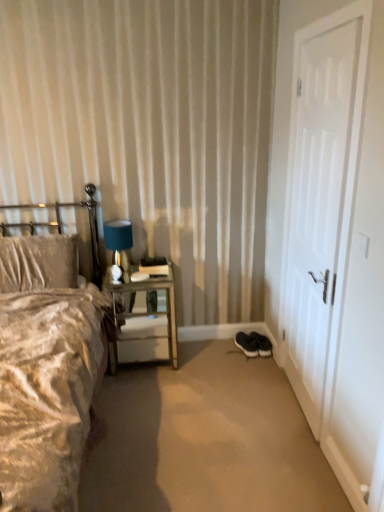
Identify the location of vacant area that lies between white matte door at right and black suede sneakers at lower right, arranged as the 2th footwear when viewed from the right. (278, 382).